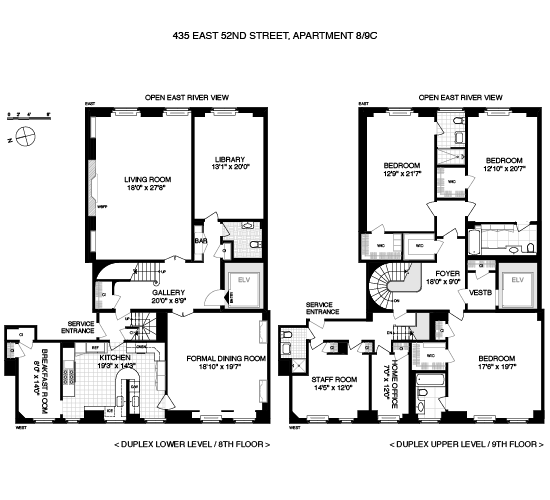
Where is `floor plan area label`? floor plan area label is located at coordinates (209, 444), (446, 440).